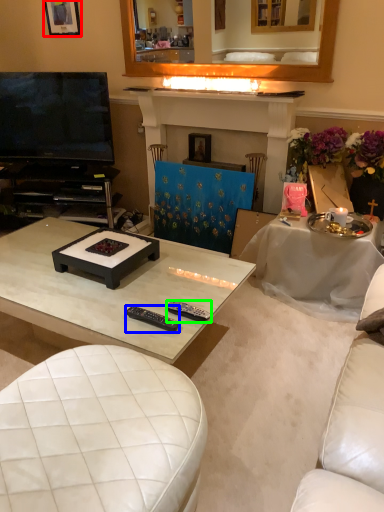
Question: Which is farther away from picture frame (highlighted by a red box)? remote control (highlighted by a blue box) or remote control (highlighted by a green box)?

Choices:
 (A) remote control
 (B) remote control

Answer: (B)